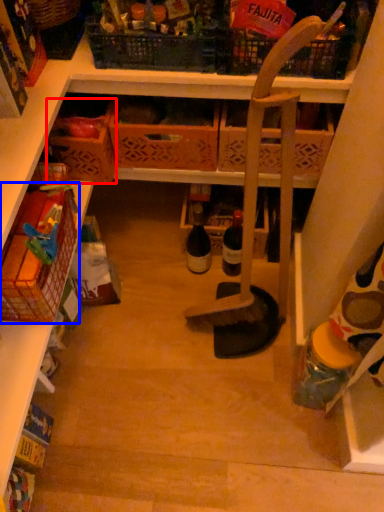
Question: Which point is further to the camera, basket (highlighted by a red box) or basket (highlighted by a blue box)?

Choices:
 (A) basket
 (B) basket

Answer: (A)